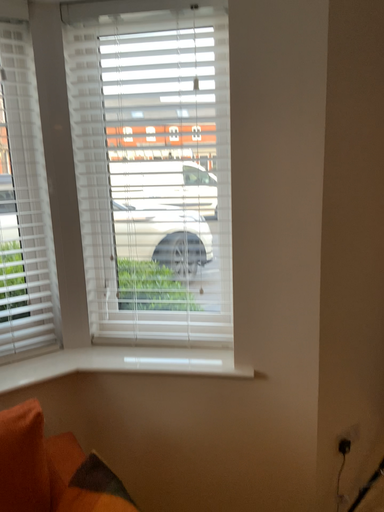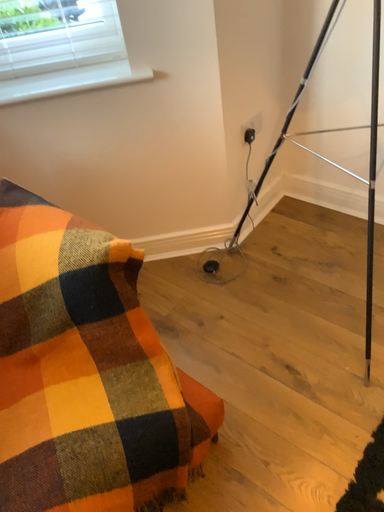
Question: Which way did the camera rotate in the video?

Choices:
 (A) rotated downward
 (B) rotated upward

Answer: (A)